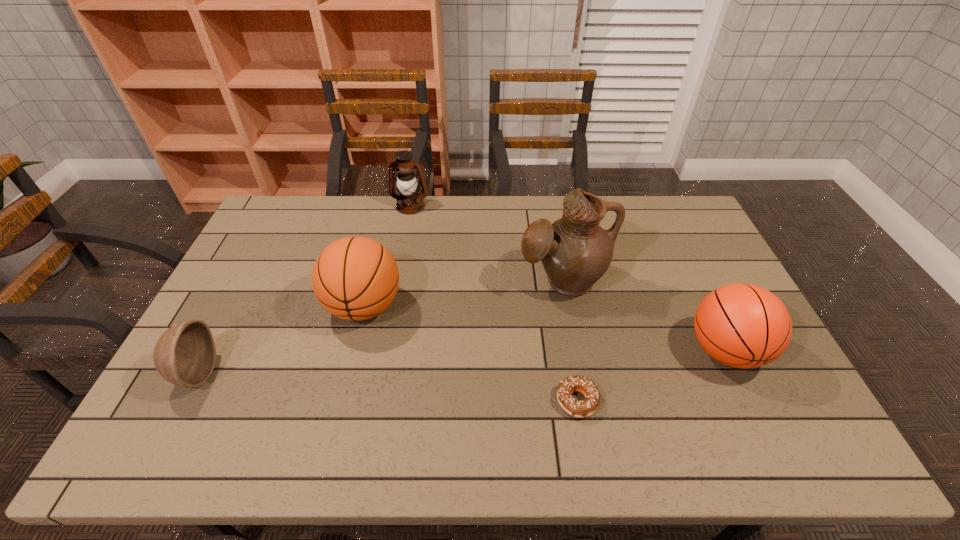
This screenshot has height=540, width=960. Identify the location of vacant space that's between the shortest object and the left basketball. (470, 354).

Locate an element on the screen. vacant area that lies between the right basketball and the left basketball is located at coordinates click(544, 328).

At what (x,y) coordinates should I click in order to perform the action: click on blank region between the leftmost object and the tallest object. Please return your answer as a coordinate pair (x, y). The image size is (960, 540). Looking at the image, I should click on (380, 327).

Find the location of `vacant point located between the left basketball and the right basketball`. vacant point located between the left basketball and the right basketball is located at coordinates (544, 328).

Where is `unoccupied area between the leftmost object and the farthest object`? The width and height of the screenshot is (960, 540). unoccupied area between the leftmost object and the farthest object is located at coordinates (303, 289).

You are a GUI agent. You are given a task and a screenshot of the screen. Output one action in this format:
    pyautogui.click(x=<x>, y=<y>)
    Task: Click on the free space between the bowl and the farthest object
    The image size is (960, 540).
    Given the screenshot: What is the action you would take?
    pyautogui.click(x=303, y=289)

This screenshot has width=960, height=540. I want to click on free space between the shortest object and the right basketball, so click(x=651, y=376).

Find the location of a particular element. The image size is (960, 540). free space between the tallest object and the right basketball is located at coordinates (644, 315).

Identify the location of vacant area that lies between the left basketball and the tallest object. The height and width of the screenshot is (540, 960). (464, 293).

At what (x,y) coordinates should I click in order to perform the action: click on free space between the right basketball and the shortest object. Please return your answer as a coordinate pair (x, y). The height and width of the screenshot is (540, 960). Looking at the image, I should click on (651, 376).